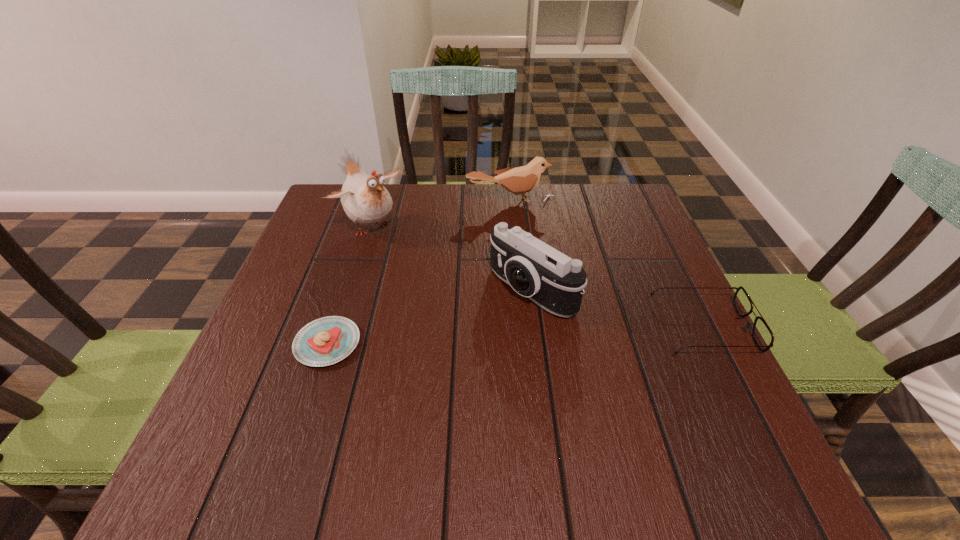
Locate an element on the screen. unoccupied area between the taller bird and the shorter bird is located at coordinates (441, 214).

Where is `free spot between the shortest object and the camera`? The width and height of the screenshot is (960, 540). free spot between the shortest object and the camera is located at coordinates (430, 316).

Locate an element on the screen. This screenshot has height=540, width=960. free space between the pastry and the camera is located at coordinates (430, 316).

Find the location of a particular element. Image resolution: width=960 pixels, height=540 pixels. free spot between the pastry and the camera is located at coordinates (430, 316).

Where is `vacant space that's between the rightmost object and the right bird`? The height and width of the screenshot is (540, 960). vacant space that's between the rightmost object and the right bird is located at coordinates (607, 265).

Locate an element on the screen. empty space that is in between the rightmost object and the shortest object is located at coordinates (516, 336).

In order to click on empty space between the shortest object and the tallest object in this screenshot , I will do (x=348, y=285).

The height and width of the screenshot is (540, 960). I want to click on vacant region between the fourth tallest object and the camera, so point(617,309).

Where is `object that stands as the second closest to the shorter bird`? Image resolution: width=960 pixels, height=540 pixels. object that stands as the second closest to the shorter bird is located at coordinates point(533,269).

Find the location of a particular element. This screenshot has height=540, width=960. the third closest object to the shortest object is located at coordinates (519, 180).